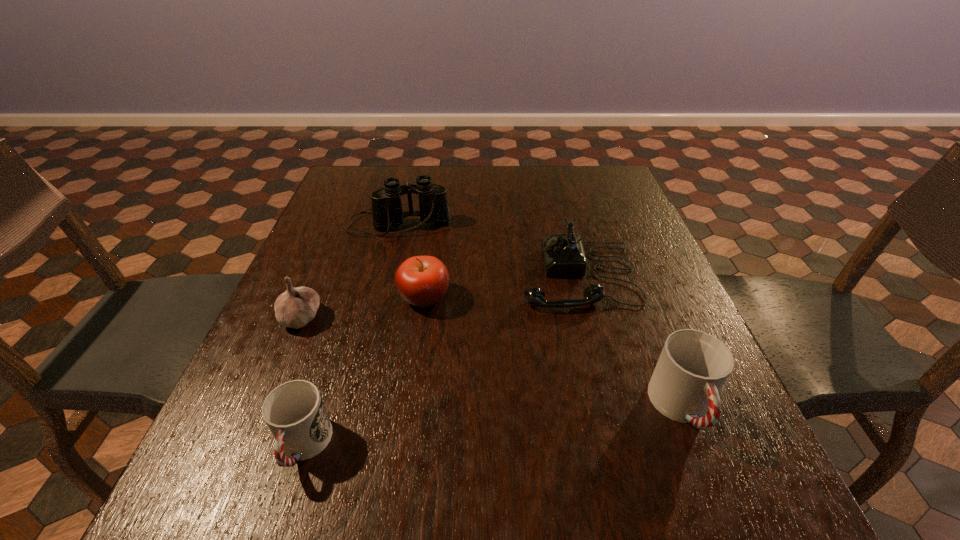
At what (x,y) coordinates should I click in order to perform the action: click on the shorter cup. Please return your answer as a coordinate pair (x, y). The width and height of the screenshot is (960, 540). Looking at the image, I should click on (294, 412).

Where is `the taller cup`? Image resolution: width=960 pixels, height=540 pixels. the taller cup is located at coordinates [x=693, y=366].

The height and width of the screenshot is (540, 960). What are the coordinates of `the farthest object` in the screenshot? It's located at (386, 208).

The width and height of the screenshot is (960, 540). I want to click on telephone, so click(563, 254).

Where is `garlic`? garlic is located at coordinates (297, 306).

The width and height of the screenshot is (960, 540). Find the location of `apple`. apple is located at coordinates (422, 281).

This screenshot has width=960, height=540. Find the location of `blank area located 0.090m on the right of the binoculars`. blank area located 0.090m on the right of the binoculars is located at coordinates (484, 225).

You are a GUI agent. You are given a task and a screenshot of the screen. Output one action in this format:
    pyautogui.click(x=<x>, y=<y>)
    Task: Click on the vacant space located on the dial of the telephone
    The image size is (960, 540).
    Given the screenshot: What is the action you would take?
    pyautogui.click(x=351, y=275)

This screenshot has height=540, width=960. Find the location of `free space located 0.150m on the dial of the telephone`. free space located 0.150m on the dial of the telephone is located at coordinates (456, 275).

Where is `vacant space located on the dial of the telephone`? vacant space located on the dial of the telephone is located at coordinates (385, 275).